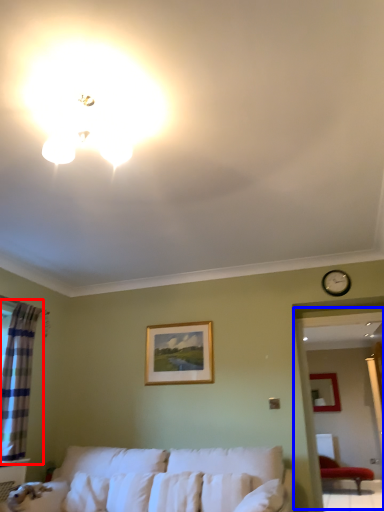
Question: Which of the following is the farthest to the observer, curtain (highlighted by a red box) or bay window (highlighted by a blue box)?

Choices:
 (A) curtain
 (B) bay window

Answer: (B)